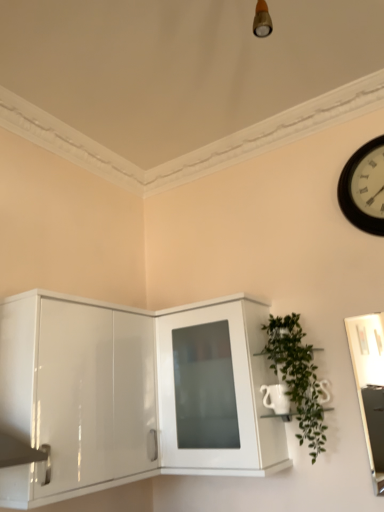
Question: From the image's perspective, would you say glossy white cabinet at lower left, positioned as the second cabinetry in right-to-left order, is shown under white glossy cabinet at center, which is the 1th cabinetry from right to left?

Choices:
 (A) no
 (B) yes

Answer: (A)

Question: Is glossy white cabinet at lower left, the 1th cabinetry in the left-to-right sequence, facing towards white glossy cabinet at center, which is the 1th cabinetry from right to left?

Choices:
 (A) yes
 (B) no

Answer: (B)

Question: Is glossy white cabinet at lower left, positioned as the second cabinetry in right-to-left order, bigger than white glossy cabinet at center, which is the 1th cabinetry from right to left?

Choices:
 (A) yes
 (B) no

Answer: (A)

Question: Considering the relative positions of glossy white cabinet at lower left, positioned as the second cabinetry in right-to-left order, and white glossy cabinet at center, which is the second cabinetry in left-to-right order, in the image provided, is glossy white cabinet at lower left, positioned as the second cabinetry in right-to-left order, to the right of white glossy cabinet at center, which is the second cabinetry in left-to-right order, from the viewer's perspective?

Choices:
 (A) no
 (B) yes

Answer: (A)

Question: From the image's perspective, is glossy white cabinet at lower left, the 1th cabinetry in the left-to-right sequence, over white glossy cabinet at center, which is the second cabinetry in left-to-right order?

Choices:
 (A) no
 (B) yes

Answer: (B)

Question: Can you confirm if glossy white cabinet at lower left, positioned as the second cabinetry in right-to-left order, is taller than white glossy cabinet at center, which is the 1th cabinetry from right to left?

Choices:
 (A) no
 (B) yes

Answer: (B)

Question: Considering the relative positions of black wooden clock at upper right and glossy white cabinet at lower left, positioned as the second cabinetry in right-to-left order, in the image provided, is black wooden clock at upper right to the left of glossy white cabinet at lower left, positioned as the second cabinetry in right-to-left order, from the viewer's perspective?

Choices:
 (A) yes
 (B) no

Answer: (B)

Question: Does black wooden clock at upper right have a greater width compared to glossy white cabinet at lower left, the 1th cabinetry in the left-to-right sequence?

Choices:
 (A) no
 (B) yes

Answer: (A)

Question: Considering the relative positions of black wooden clock at upper right and glossy white cabinet at lower left, positioned as the second cabinetry in right-to-left order, in the image provided, is black wooden clock at upper right behind glossy white cabinet at lower left, positioned as the second cabinetry in right-to-left order,?

Choices:
 (A) yes
 (B) no

Answer: (A)

Question: Considering the relative sizes of black wooden clock at upper right and glossy white cabinet at lower left, positioned as the second cabinetry in right-to-left order, in the image provided, is black wooden clock at upper right thinner than glossy white cabinet at lower left, positioned as the second cabinetry in right-to-left order,?

Choices:
 (A) no
 (B) yes

Answer: (B)

Question: Is black wooden clock at upper right closer to the viewer compared to glossy white cabinet at lower left, the 1th cabinetry in the left-to-right sequence?

Choices:
 (A) no
 (B) yes

Answer: (A)

Question: From a real-world perspective, is black wooden clock at upper right physically above glossy white cabinet at lower left, positioned as the second cabinetry in right-to-left order?

Choices:
 (A) no
 (B) yes

Answer: (B)

Question: Is black wooden clock at upper right bigger than green leafy plant at right?

Choices:
 (A) yes
 (B) no

Answer: (B)